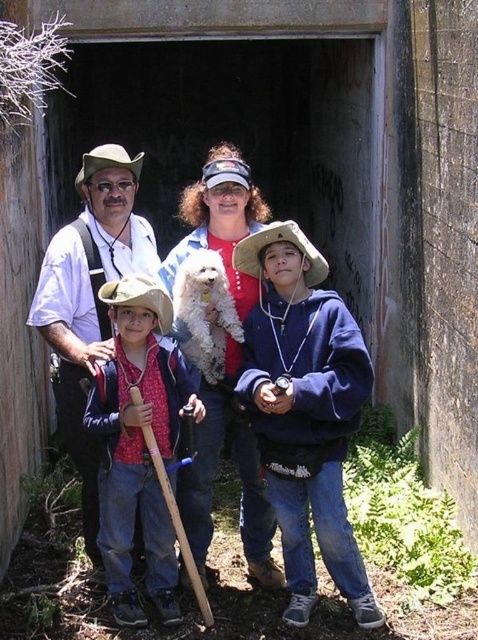
Question: Does blue fleece jacket at center have a larger size compared to strawhat at center?

Choices:
 (A) no
 (B) yes

Answer: (A)

Question: Is matte red shirt at center to the right of matte blue jacket at center from the viewer's perspective?

Choices:
 (A) no
 (B) yes

Answer: (A)

Question: Is blue fleece jacket at center below strawhat at center?

Choices:
 (A) yes
 (B) no

Answer: (A)

Question: Which point appears closest to the camera in this image?

Choices:
 (A) [141, 435]
 (B) [273, 582]
 (C) [257, 499]
 (D) [112, 301]

Answer: (D)

Question: Estimate the real-world distances between objects in this image. Which object is closer to the white fluffy dog at center?

Choices:
 (A) strawhat at center
 (B) matte white shirt at center
 (C) brown straw hat at center
 (D) blue fleece jacket at center

Answer: (D)

Question: Which object appears farthest from the camera in this image?

Choices:
 (A) matte red shirt at center
 (B) strawhat at center
 (C) matte white shirt at center

Answer: (B)